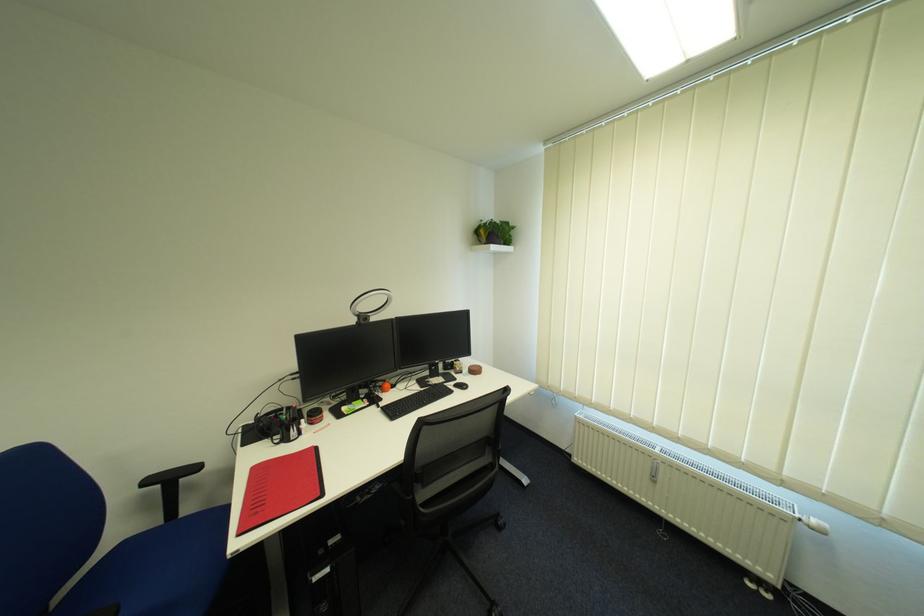
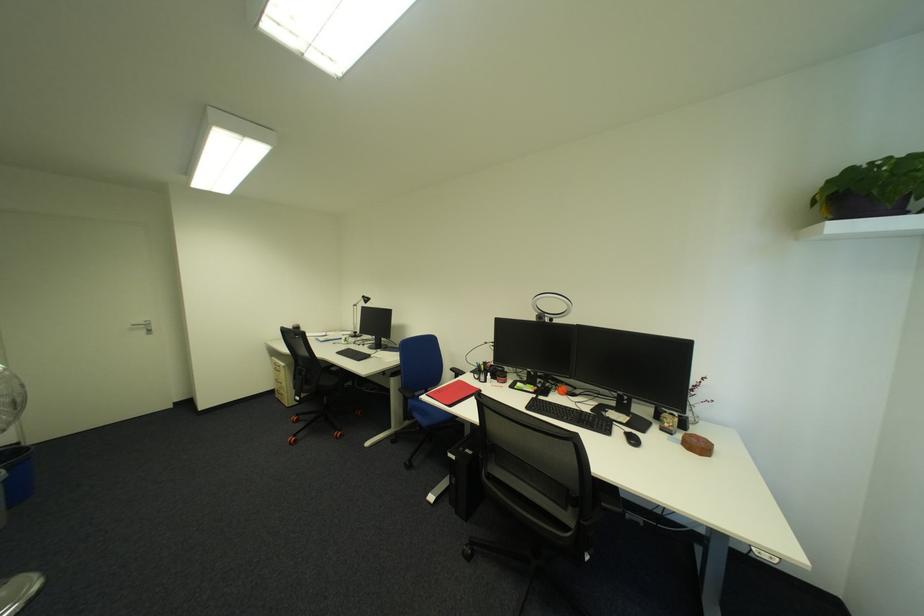
Where in the second image is the point corresponding to point 435,402 from the first image?

(577, 419)